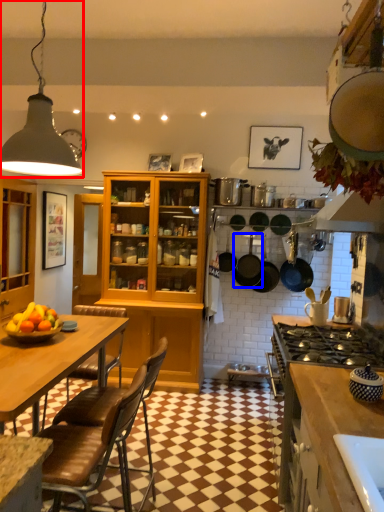
Question: Among these objects, which one is farthest to the camera, light fixture (highlighted by a red box) or kitchen appliance (highlighted by a blue box)?

Choices:
 (A) light fixture
 (B) kitchen appliance

Answer: (B)